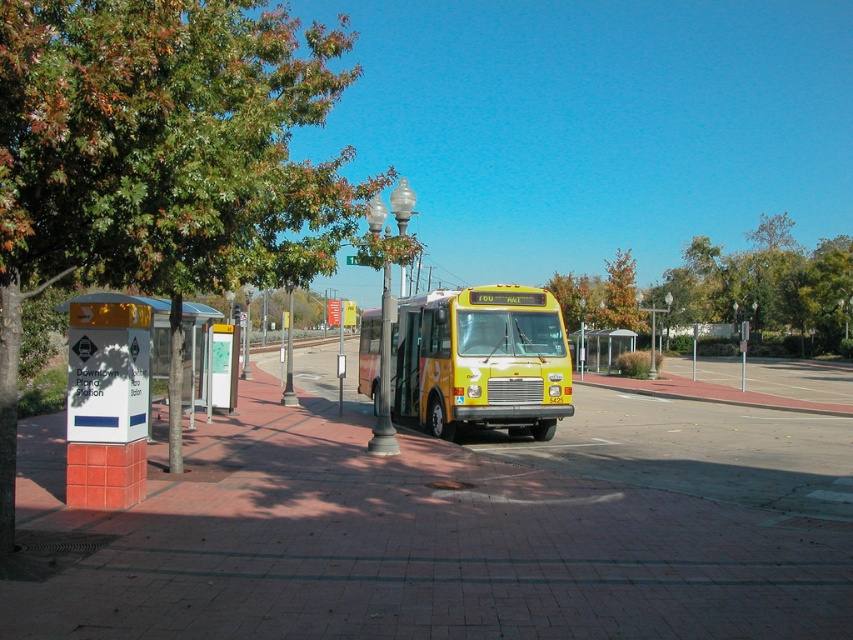
Does green leafy tree at upper left appear under green leafy tree at center?

No, green leafy tree at upper left is not below green leafy tree at center.

Can you confirm if green leafy tree at upper left is bigger than green leafy tree at center?

Yes.

What are the coordinates of `green leafy tree at upper left` in the screenshot? It's located at (160, 157).

Who is taller, green leafy tree at upper left or yellow matte bus at center?

With more height is green leafy tree at upper left.

Can you confirm if green leafy tree at upper left is positioned to the left of yellow matte bus at center?

Correct, you'll find green leafy tree at upper left to the left of yellow matte bus at center.

Which is in front, point (1, 10) or point (531, 340)?

Point (1, 10) is in front.

Identify the location of green leafy tree at upper left. Image resolution: width=853 pixels, height=640 pixels. (160, 157).

The width and height of the screenshot is (853, 640). I want to click on brick pavement at center, so click(x=454, y=529).

Does brick pavement at center have a lesser height compared to green leafy tree at center?

Indeed, brick pavement at center has a lesser height compared to green leafy tree at center.

The height and width of the screenshot is (640, 853). In order to click on brick pavement at center in this screenshot , I will do `click(454, 529)`.